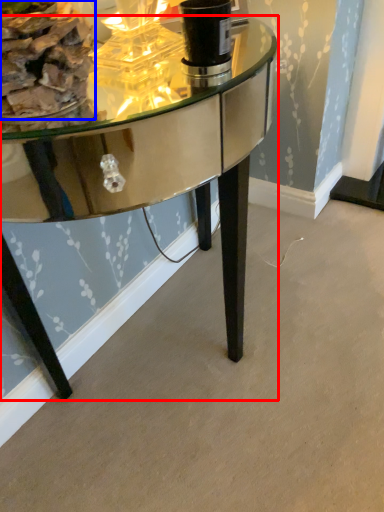
Question: Which object appears farthest to the camera in this image, table (highlighted by a red box) or food (highlighted by a blue box)?

Choices:
 (A) table
 (B) food

Answer: (B)